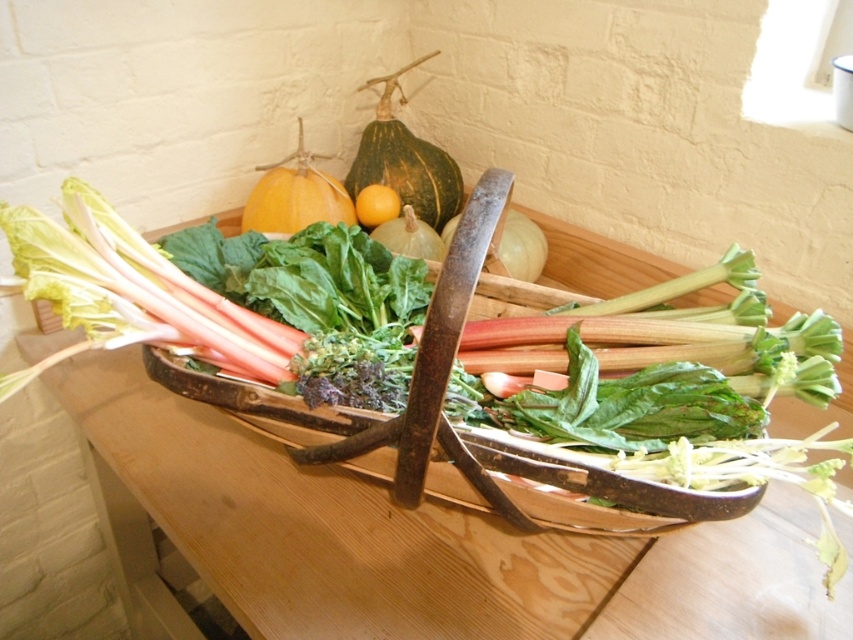
Question: In this image, where is green textured squash at upper center located relative to yellow smooth orange at center?

Choices:
 (A) right
 (B) left

Answer: (A)

Question: Based on their relative distances, which object is nearer to the wooden table at center?

Choices:
 (A) smooth orange squash at upper center
 (B) green textured squash at upper center

Answer: (A)

Question: Can you confirm if green textured squash at upper center is thinner than smooth orange squash at upper center?

Choices:
 (A) no
 (B) yes

Answer: (A)

Question: Among these points, which one is farthest from the camera?

Choices:
 (A) (170, 449)
 (B) (387, 125)
 (C) (357, 211)
 (D) (271, 230)

Answer: (B)

Question: Can you confirm if wooden table at center is bigger than green textured squash at upper center?

Choices:
 (A) yes
 (B) no

Answer: (A)

Question: Which of the following is the closest to the observer?

Choices:
 (A) wooden table at center
 (B) smooth orange squash at upper center
 (C) green textured squash at upper center

Answer: (A)